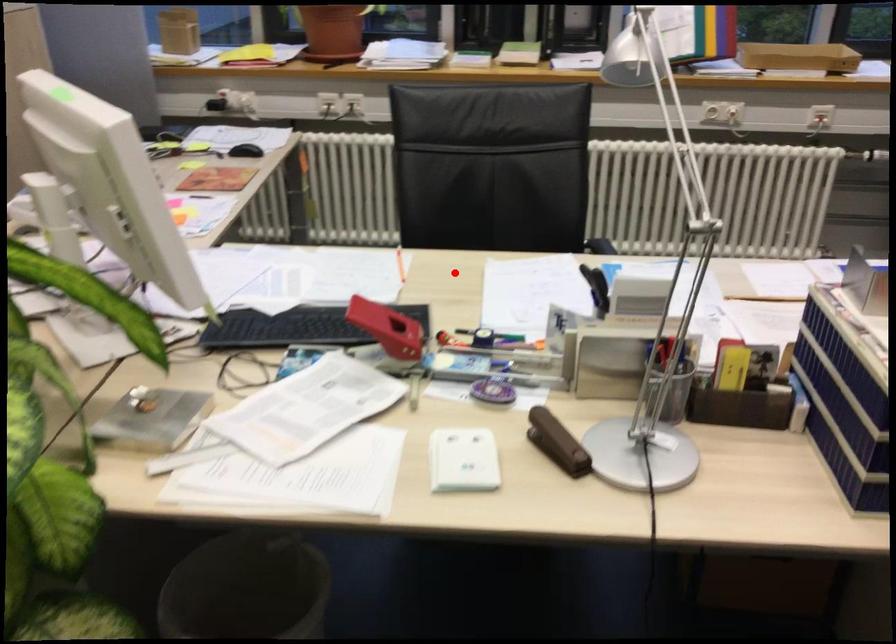
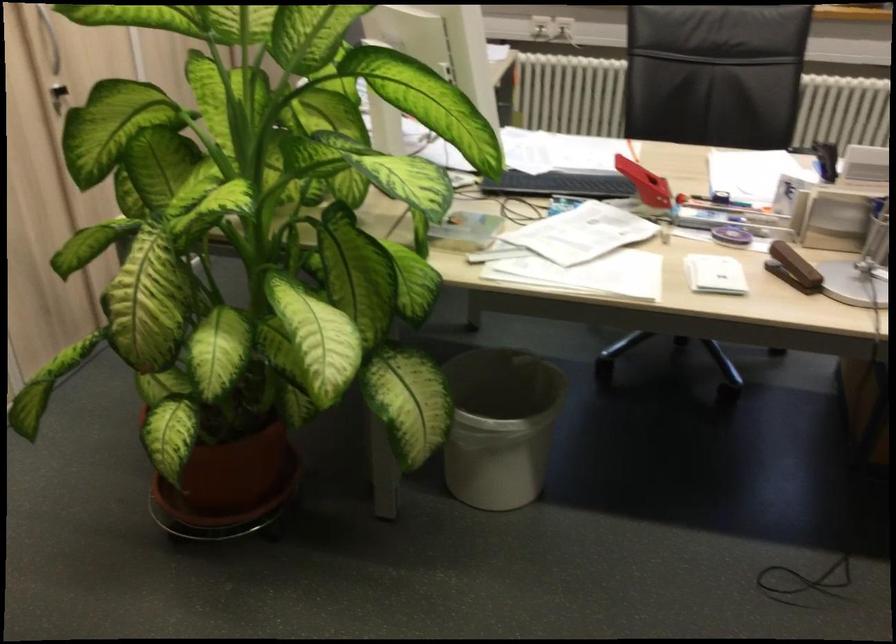
Question: I am providing you with two images of the same scene from different viewpoints. Image1 has a red point marked. In image2, the corresponding 3D location appears at what relative position? Reply with the corresponding letter.

Choices:
 (A) Closer
 (B) Farther

Answer: (B)